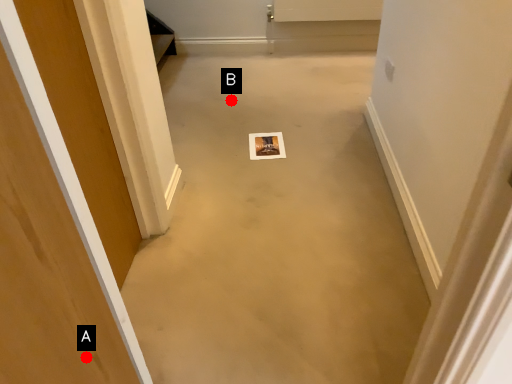
Question: Two points are circled on the image, labeled by A and B beside each circle. Among these points, which one is farthest from the camera?

Choices:
 (A) A is further
 (B) B is further

Answer: (B)